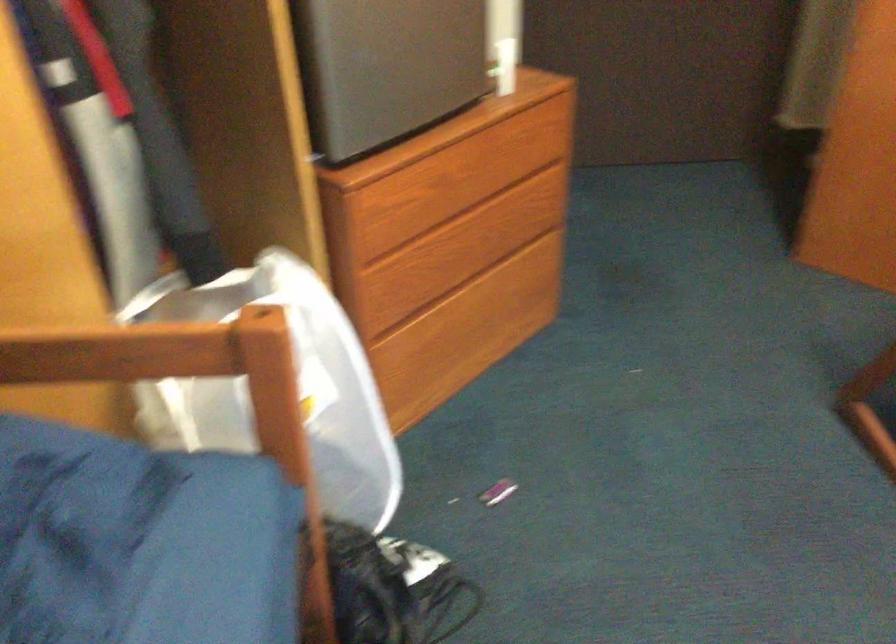
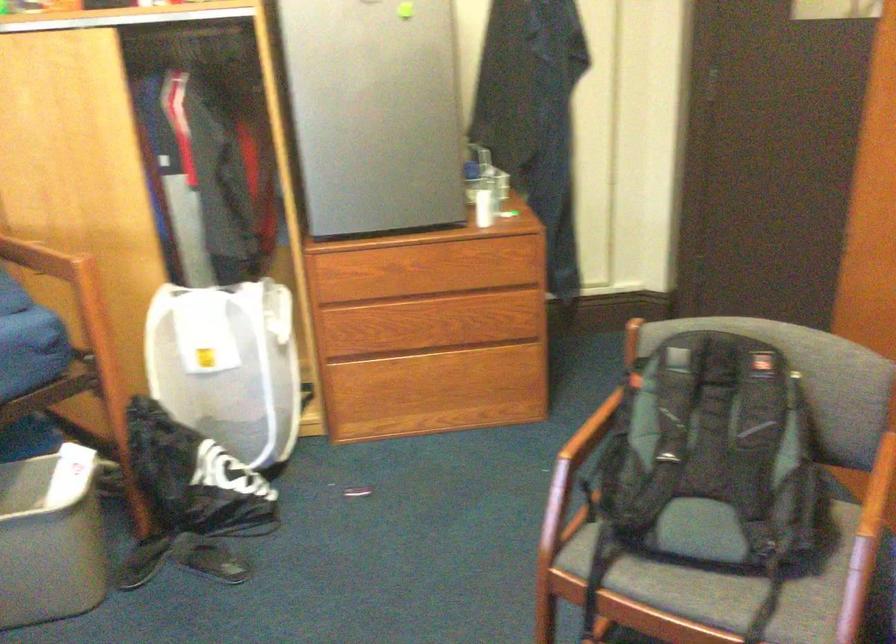
Find the pixel in the second image that matches point (449, 341) in the first image.

(419, 397)